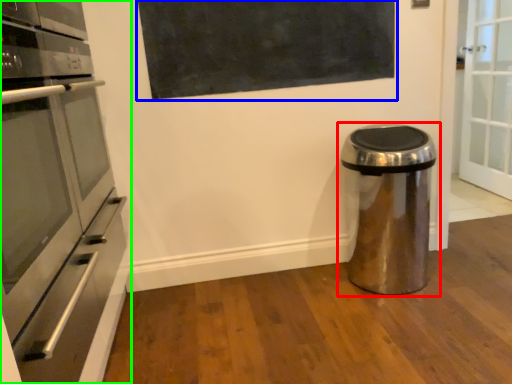
Question: Estimate the real-world distances between objects in this image. Which object is closer to waste container (highlighted by a red box), bulletin board (highlighted by a blue box) or home appliance (highlighted by a green box)?

Choices:
 (A) bulletin board
 (B) home appliance

Answer: (A)